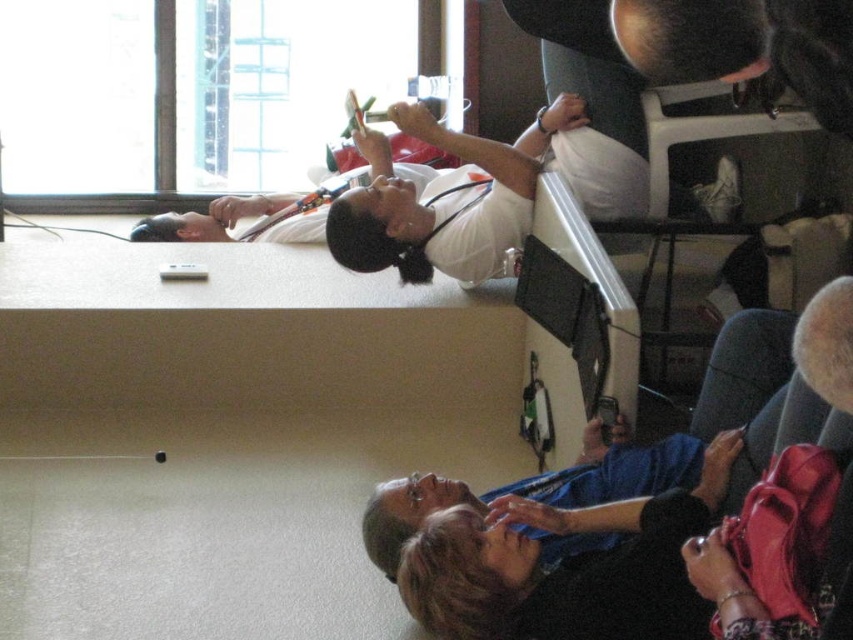
Question: Considering the relative positions of white matte stethoscope at upper center and blue fabric shirt at lower right in the image provided, where is white matte stethoscope at upper center located with respect to blue fabric shirt at lower right?

Choices:
 (A) left
 (B) right

Answer: (A)

Question: Can you confirm if white matte stethoscope at upper center is positioned above blue fabric shirt at lower right?

Choices:
 (A) no
 (B) yes

Answer: (B)

Question: Can you confirm if white matte stethoscope at upper center is positioned to the left of blue fabric shirt at lower right?

Choices:
 (A) no
 (B) yes

Answer: (B)

Question: Which point is closer to the camera?

Choices:
 (A) blue fabric shirt at lower right
 (B) white matte stethoscope at upper center

Answer: (A)